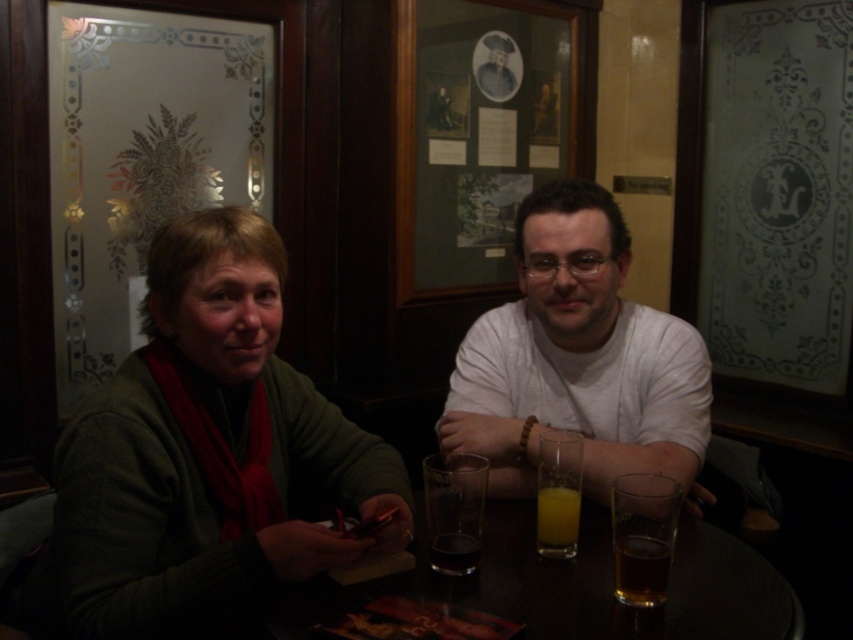
Question: From the image, what is the correct spatial relationship of translucent glass table at center in relation to brown translucent glass at lower right?

Choices:
 (A) right
 (B) left

Answer: (B)

Question: Which object appears closest to the camera in this image?

Choices:
 (A) brown translucent glass at lower right
 (B) green sweater at left
 (C) translucent glass at table center
 (D) white matte shirt at center

Answer: (B)

Question: Can you confirm if brown translucent glass at lower right is positioned to the left of clear glass at table center?

Choices:
 (A) no
 (B) yes

Answer: (A)

Question: Estimate the real-world distances between objects in this image. Which object is closer to the brown translucent glass at lower right?

Choices:
 (A) green sweater at left
 (B) translucent glass table at center
 (C) white matte shirt at center

Answer: (B)

Question: Which object is the closest to the clear glass at table center?

Choices:
 (A) translucent glass at table center
 (B) brown translucent glass at lower right

Answer: (A)

Question: Is white matte shirt at center to the right of translucent glass at table center from the viewer's perspective?

Choices:
 (A) no
 (B) yes

Answer: (B)